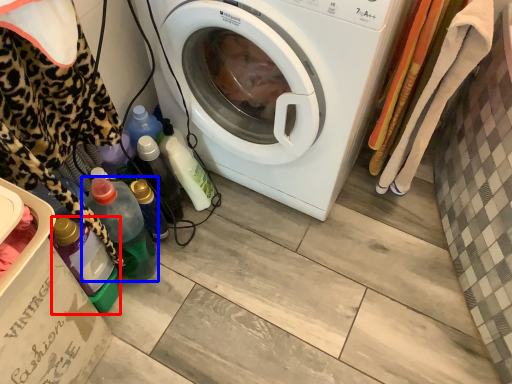
Question: Which object appears farthest to the camera in this image, bottle (highlighted by a red box) or bottle (highlighted by a blue box)?

Choices:
 (A) bottle
 (B) bottle

Answer: (B)